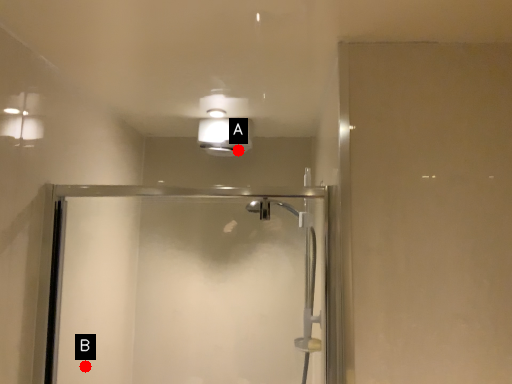
Question: Two points are circled on the image, labeled by A and B beside each circle. Among these points, which one is farthest from the camera?

Choices:
 (A) A is further
 (B) B is further

Answer: (A)